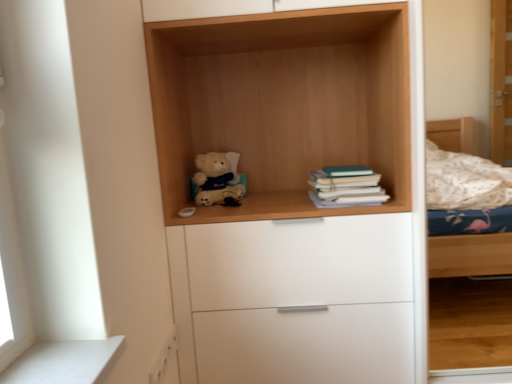
What do you see at coordinates (347, 186) in the screenshot?
I see `teal matte book at center right` at bounding box center [347, 186].

This screenshot has height=384, width=512. In order to click on teal matte book at center right in this screenshot , I will do `click(347, 186)`.

You are a GUI agent. You are given a task and a screenshot of the screen. Output one action in this format:
    pyautogui.click(x=<x>, y=<y>)
    Task: Click on the soft plush teddy bear at center
    
    Given the screenshot: What is the action you would take?
    pyautogui.click(x=217, y=179)

Describe the element at coordinates (292, 207) in the screenshot. The image size is (512, 384). I see `light wood/texture teddy bear at center` at that location.

This screenshot has height=384, width=512. Describe the element at coordinates (294, 300) in the screenshot. I see `white matte chest of drawers at center` at that location.

In order to face white matte drawer at lower left, should I rotate leftwards or rightwards?

A 11.777 degree turn to the left will do.

The width and height of the screenshot is (512, 384). I want to click on teal matte book at center right, so click(347, 186).

Considering the sizes of white matte chest of drawers at center and white matte drawer at lower left in the image, is white matte chest of drawers at center wider or thinner than white matte drawer at lower left?

white matte chest of drawers at center is wider than white matte drawer at lower left.

I want to click on drawer below the white matte chest of drawers at center (from a real-world perspective), so click(163, 358).

From a real-world perspective, is white matte chest of drawers at center located higher than white matte drawer at lower left?

Indeed, from a real-world perspective, white matte chest of drawers at center stands above white matte drawer at lower left.

Is soft plush teddy bear at center to the left or to the right of white matte chest of drawers at center in the image?

From the image, it's evident that soft plush teddy bear at center is to the left of white matte chest of drawers at center.

From the picture: Is soft plush teddy bear at center positioned in front of white matte chest of drawers at center?

No, soft plush teddy bear at center is behind white matte chest of drawers at center.

From the image's perspective, is soft plush teddy bear at center under white matte chest of drawers at center?

No, from the image's perspective, soft plush teddy bear at center is not beneath white matte chest of drawers at center.

From a real-world perspective, is soft plush teddy bear at center below white matte chest of drawers at center?

No, from a real-world perspective, soft plush teddy bear at center is not below white matte chest of drawers at center.

Can you confirm if teal matte book at center right is thinner than white matte drawer at lower left?

In fact, teal matte book at center right might be wider than white matte drawer at lower left.

This screenshot has width=512, height=384. Find the location of `book above the white matte drawer at lower left (from the image's perspective)`. book above the white matte drawer at lower left (from the image's perspective) is located at coordinates (347, 186).

Considering the relative positions of teal matte book at center right and white matte drawer at lower left in the image provided, is teal matte book at center right behind white matte drawer at lower left?

Yes, teal matte book at center right is behind white matte drawer at lower left.

Is white matte drawer at lower left beside light wood/texture teddy bear at center?

There is a gap between white matte drawer at lower left and light wood/texture teddy bear at center.

From a real-world perspective, which is physically below, white matte drawer at lower left or light wood/texture teddy bear at center?

white matte drawer at lower left, from a real-world perspective.

From their relative heights in the image, would you say white matte drawer at lower left is taller or shorter than light wood/texture teddy bear at center?

Considering their sizes, white matte drawer at lower left has less height than light wood/texture teddy bear at center.

Could you tell me if white matte drawer at lower left is turned towards light wood/texture teddy bear at center?

No, white matte drawer at lower left is not turned towards light wood/texture teddy bear at center.

Would you say soft plush teddy bear at center is a long distance from teal matte book at center right?

They are positioned close to each other.

Is soft plush teddy bear at center completely or partially outside of teal matte book at center right?

soft plush teddy bear at center is positioned outside teal matte book at center right.

Is soft plush teddy bear at center at the right side of teal matte book at center right?

No.

Can you confirm if soft plush teddy bear at center is wider than white matte drawer at lower left?

Yes.

Are soft plush teddy bear at center and white matte drawer at lower left making contact?

No, soft plush teddy bear at center is not with white matte drawer at lower left.

Is white matte drawer at lower left at the back of soft plush teddy bear at center?

No, soft plush teddy bear at center is not facing away from white matte drawer at lower left.

Which is more to the right, soft plush teddy bear at center or white matte drawer at lower left?

From the viewer's perspective, soft plush teddy bear at center appears more on the right side.

Considering the positions of objects white matte chest of drawers at center and teal matte book at center right in the image provided, who is in front, white matte chest of drawers at center or teal matte book at center right?

white matte chest of drawers at center.

From the image's perspective, is white matte chest of drawers at center above or below teal matte book at center right?

white matte chest of drawers at center is situated lower than teal matte book at center right in the image.

Is white matte chest of drawers at center to the left or to the right of teal matte book at center right in the image?

In the image, white matte chest of drawers at center appears on the left side of teal matte book at center right.

Does white matte chest of drawers at center touch teal matte book at center right?

white matte chest of drawers at center and teal matte book at center right are not in contact.

Identify the location of the chest of drawers that is above the white matte drawer at lower left (from the image's perspective). The height and width of the screenshot is (384, 512). (294, 300).

This screenshot has height=384, width=512. What are the coordinates of `teddy bear lying behind the white matte chest of drawers at center` in the screenshot? It's located at (217, 179).

Looking at the image, which one is located closer to white matte chest of drawers at center, white matte drawer at lower left or light wood/texture teddy bear at center?

The object closer to white matte chest of drawers at center is light wood/texture teddy bear at center.

From the image, which object appears to be farther from white matte chest of drawers at center, teal matte book at center right or light wood/texture teddy bear at center?

The object further to white matte chest of drawers at center is teal matte book at center right.

Looking at the image, which one is located further to white matte drawer at lower left, soft plush teddy bear at center or white matte chest of drawers at center?

soft plush teddy bear at center is positioned further to the anchor white matte drawer at lower left.

From the image, which object appears to be nearer to white matte chest of drawers at center, white matte drawer at lower left or teal matte book at center right?

The object closer to white matte chest of drawers at center is teal matte book at center right.

Estimate the real-world distances between objects in this image. Which object is further from white matte chest of drawers at center, light wood/texture teddy bear at center or white matte drawer at lower left?

Based on the image, white matte drawer at lower left appears to be further to white matte chest of drawers at center.

When comparing their distances from white matte chest of drawers at center, does teal matte book at center right or soft plush teddy bear at center seem closer?

Among the two, teal matte book at center right is located nearer to white matte chest of drawers at center.

When comparing their distances from light wood/texture teddy bear at center, does soft plush teddy bear at center or white matte drawer at lower left seem further?

Based on the image, white matte drawer at lower left appears to be further to light wood/texture teddy bear at center.

Looking at the image, which one is located closer to soft plush teddy bear at center, light wood/texture teddy bear at center or white matte drawer at lower left?

light wood/texture teddy bear at center is closer to soft plush teddy bear at center.

Locate an element on the screen. The image size is (512, 384). book between light wood/texture teddy bear at center and white matte chest of drawers at center in the vertical direction is located at coordinates (347, 186).

The image size is (512, 384). Find the location of `teddy bear that lies between light wood/texture teddy bear at center and white matte drawer at lower left from top to bottom`. teddy bear that lies between light wood/texture teddy bear at center and white matte drawer at lower left from top to bottom is located at coordinates (217, 179).

What are the coordinates of `the chest of drawers located between white matte drawer at lower left and teal matte book at center right in the left-right direction` in the screenshot? It's located at (294, 300).

Locate an element on the screen. The width and height of the screenshot is (512, 384). book positioned between light wood/texture teddy bear at center and soft plush teddy bear at center from near to far is located at coordinates (347, 186).